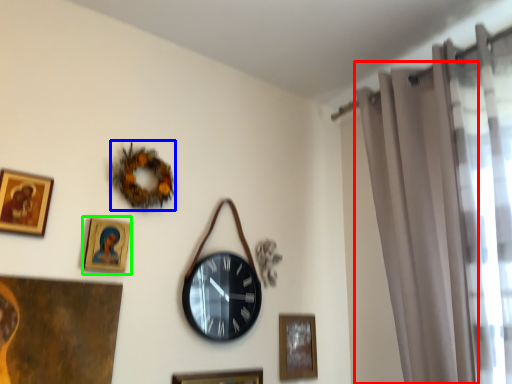
Question: Which object is the closest to the curtain (highlighted by a red box)? Choose among these: decor (highlighted by a blue box) or picture frame (highlighted by a green box).

Choices:
 (A) decor
 (B) picture frame

Answer: (A)